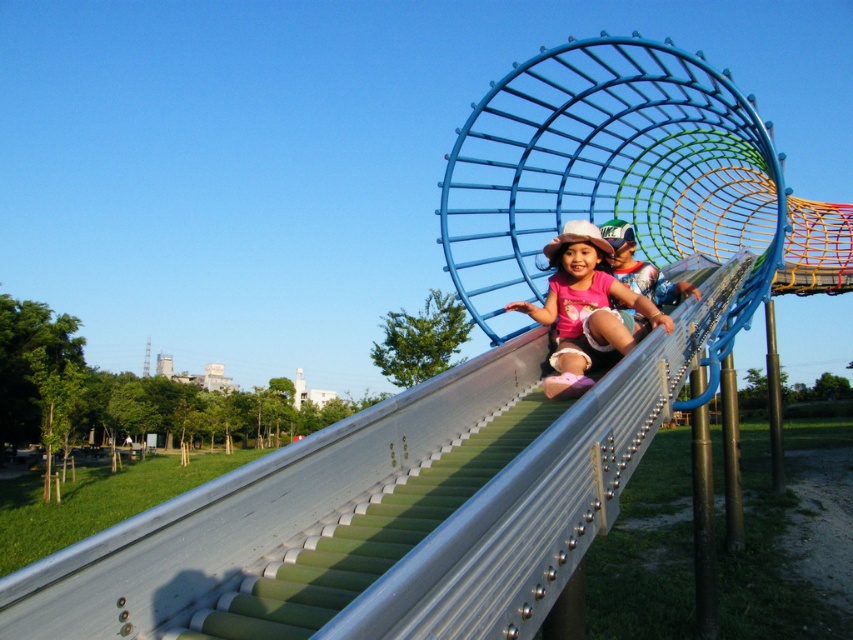
You are designing a new playground uniform and need to ensure that the pants and shirt will fit properly. Given that the pink fabric pants at center are wider than the matte pink shirt at center, which item would require more fabric in its design?

The pink fabric pants at center would require more fabric in its design since its width is larger than the matte pink shirt at center.

You are a parent trying to locate your child who is wearing pink fabric pants at center and a matte pink shirt at center at the playground. Can you see both items of clothing clearly from where you are standing?

The pink fabric pants at center and matte pink shirt at center are 4.20 feet apart, so yes, you can see both items of clothing clearly from where you are standing.

Based on the coordinates provided, what object is located at point (590, 308) in the playground scene?

The point (590, 308) indicates pink fabric pants at center.